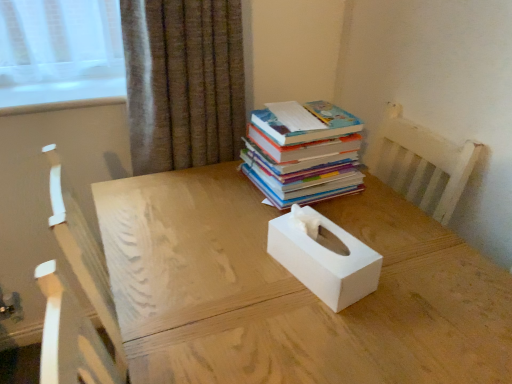
Find the location of a particular element. blank space above white matte tissue box at center (from a real-world perspective) is located at coordinates (278, 262).